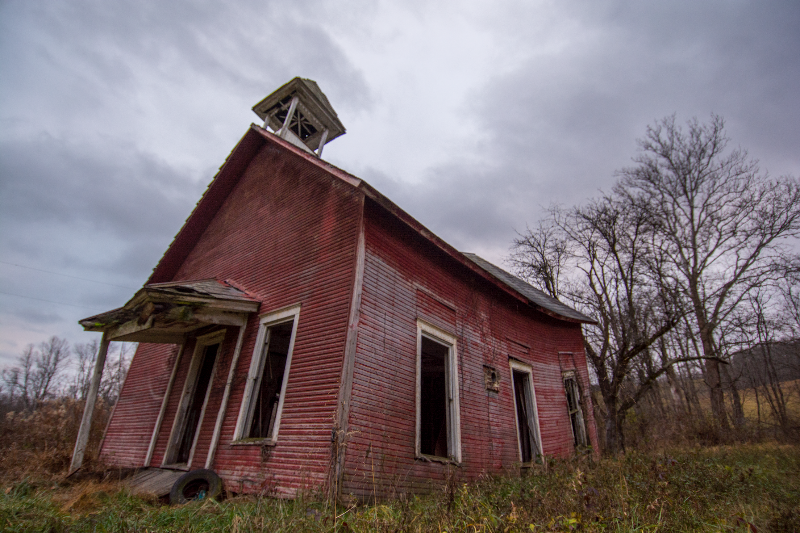
I want to click on column, so click(96, 384).